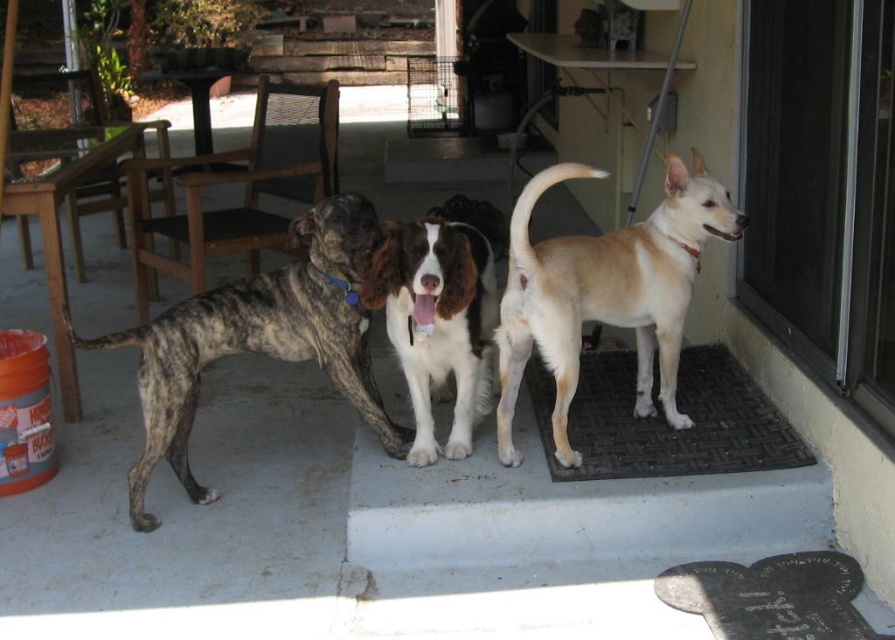
Question: Is light brown fur at center positioned behind brindle fur dog at left?

Choices:
 (A) yes
 (B) no

Answer: (B)

Question: Which of the following is the closest to the observer?

Choices:
 (A) (564, 406)
 (B) (848, 108)
 (C) (472, 336)
 (D) (729, 358)

Answer: (B)

Question: Which object is the farthest from the brindle fur dog at left?

Choices:
 (A) light brown fur at center
 (B) transparent glass door at upper right

Answer: (B)

Question: Is black rubber doormat at lower right below white glossy dog at center?

Choices:
 (A) yes
 (B) no

Answer: (A)

Question: Which point is farther to the camera?

Choices:
 (A) (867, 12)
 (B) (329, 211)

Answer: (B)

Question: Can you confirm if brindle fur dog at left is positioned above white glossy dog at center?

Choices:
 (A) yes
 (B) no

Answer: (B)